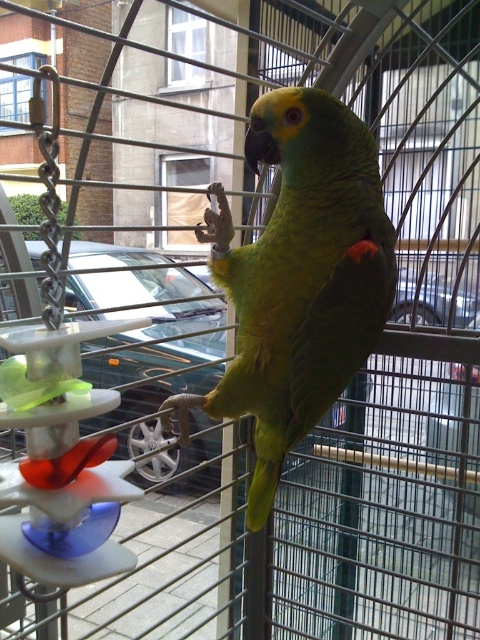
What are the coordinates of the green matte parrot at center?

The green matte parrot at center is located at point (x=299, y=278).

You are a veterinarian examining the cage setup for the green matte parrot at center and the metallic silver car at center. Based on their sizes, which object requires more horizontal space in the cage?

The metallic silver car at center requires more horizontal space in the cage since its width is greater than the green matte parrot at center.